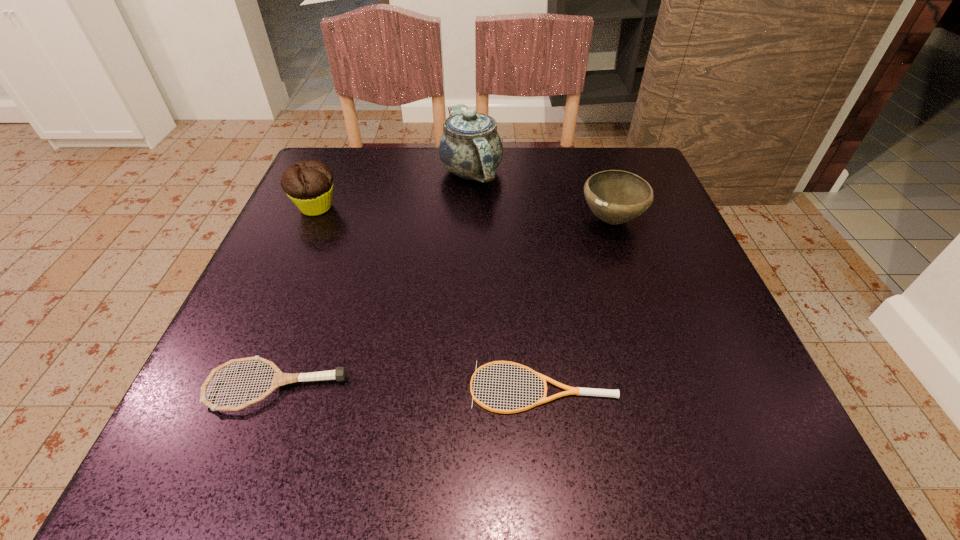
Locate an element on the screen. free point located 0.230m on the left of the rightmost object is located at coordinates (469, 220).

The width and height of the screenshot is (960, 540). In order to click on free space located on the right of the fourth tallest object in this screenshot , I will do [516, 387].

Where is `blank space located 0.150m on the right of the shorter tennis racket`? The width and height of the screenshot is (960, 540). blank space located 0.150m on the right of the shorter tennis racket is located at coordinates (718, 387).

At what (x,y) coordinates should I click in order to perform the action: click on chinaware situated at the far edge. Please return your answer as a coordinate pair (x, y). Image resolution: width=960 pixels, height=540 pixels. Looking at the image, I should click on (470, 147).

The width and height of the screenshot is (960, 540). Identify the location of muffin positioned at the far edge. (309, 184).

The image size is (960, 540). In order to click on bowl situated at the far edge in this screenshot , I will do `click(615, 196)`.

Where is `muffin located in the left edge section of the desktop`? muffin located in the left edge section of the desktop is located at coordinates (309, 184).

The width and height of the screenshot is (960, 540). I want to click on tennis racket that is at the left edge, so click(279, 379).

The height and width of the screenshot is (540, 960). What are the coordinates of `object at the right edge` in the screenshot? It's located at (615, 196).

This screenshot has height=540, width=960. I want to click on object situated at the far left corner, so click(x=309, y=184).